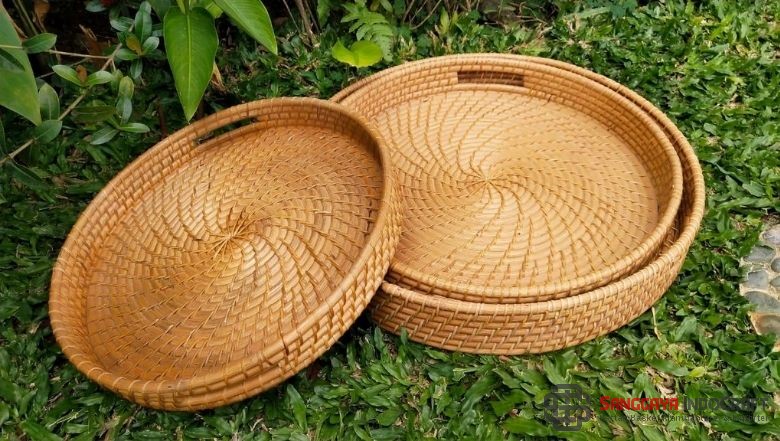
Where is `basket sitting inside another larger basket`? basket sitting inside another larger basket is located at coordinates (515, 226).